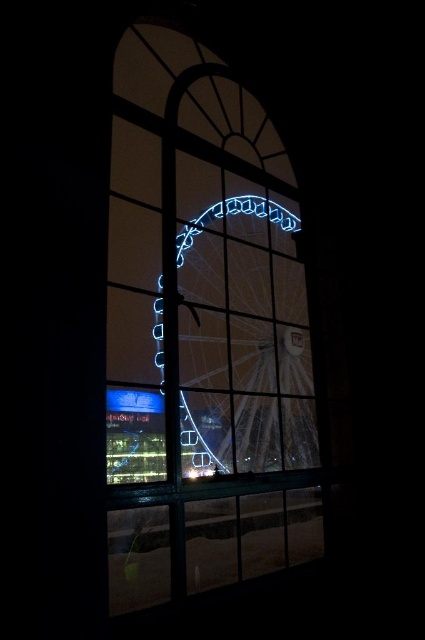
You are an interior designer assessing the view from a room. The clear glass window at center provides a view of the blue neon ferris wheel at center. If you want to ensure the window allows the entire Ferris wheel to be visible without obstruction, which object should you consider adjusting its height based on?

The clear glass window at center has a greater height compared to blue neon ferris wheel at center. Therefore, to ensure the entire Ferris wheel is visible, you should adjust the window height to match or be slightly taller than the blue neon ferris wheel at center.

You are standing in a room with a clear glass window at center and a blue neon ferris wheel at center. Which object is closer to you?

The clear glass window at center is closer to you because it is positioned over the blue neon ferris wheel at center, indicating it is in front.

You are standing in front of a window with an arched top and dark surroundings. You notice two points marked on the window glass at coordinates point [221,173] and point [271,227]. If you want to clean both points with a cloth, which point should you reach first to avoid smudging the other?

You should clean point [221,173] first because it is closer to the viewer than point [271,227]. Cleaning the closer point first prevents the cloth from smudging the farther point when moving towards it.